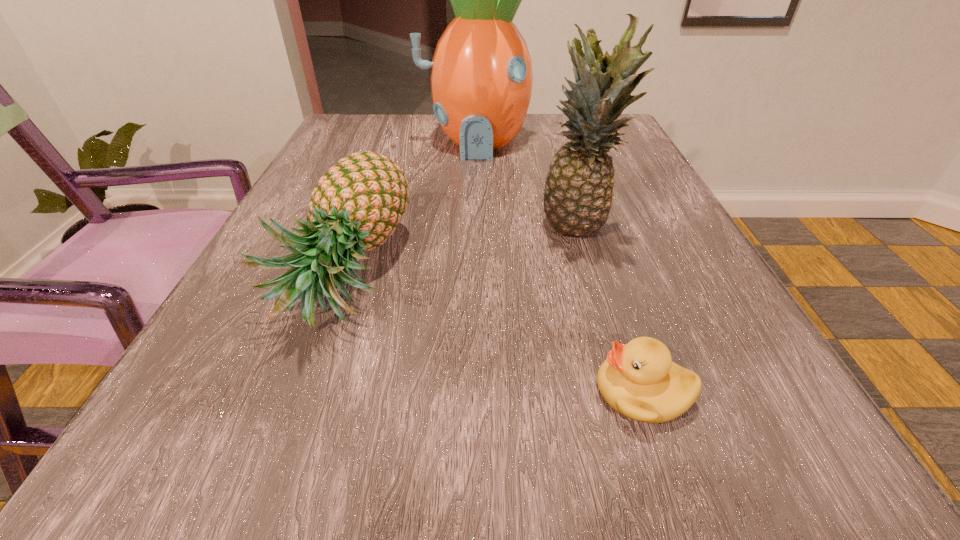
Identify the location of the farthest object. (481, 73).

Identify the location of the tallest pineapple. (481, 73).

This screenshot has height=540, width=960. Identify the location of the second tallest object. click(578, 193).

Where is `the second shortest object`? This screenshot has width=960, height=540. the second shortest object is located at coordinates (359, 202).

The image size is (960, 540). Identify the location of the shortest object. (639, 380).

Find the location of `vacant region located 0.200m at the entrance of the farthest object`. vacant region located 0.200m at the entrance of the farthest object is located at coordinates (474, 215).

In order to click on vacant space situated on the back of the third shortest object in this screenshot , I will do `click(562, 171)`.

You are a GUI agent. You are given a task and a screenshot of the screen. Output one action in this format:
    pyautogui.click(x=<x>, y=<y>)
    Task: Click on the vacant space located on the back of the second shortest object
    The image size is (960, 540).
    Given the screenshot: What is the action you would take?
    pyautogui.click(x=393, y=139)

At what (x,y) coordinates should I click in order to perform the action: click on free space located at the face of the duckling. Please return your answer as a coordinate pair (x, y). Image resolution: width=960 pixels, height=540 pixels. Looking at the image, I should click on (556, 392).

You are a GUI agent. You are given a task and a screenshot of the screen. Output one action in this format:
    pyautogui.click(x=<x>, y=<y>)
    Task: Click on the free space located 0.290m at the face of the duckling
    The height and width of the screenshot is (540, 960).
    Given the screenshot: What is the action you would take?
    pyautogui.click(x=357, y=392)